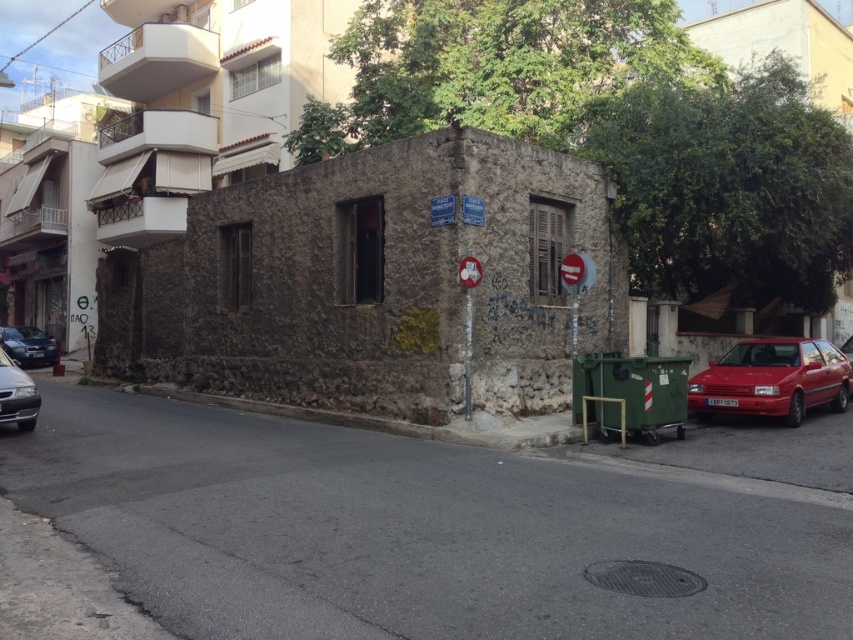
Question: Based on their relative distances, which object is nearer to the shiny black sedan at left?

Choices:
 (A) shiny red car at right
 (B) shiny silver sedan at lower left

Answer: (B)

Question: Among these objects, which one is farthest from the camera?

Choices:
 (A) shiny silver sedan at lower left
 (B) shiny black sedan at left
 (C) shiny red car at right

Answer: (B)

Question: Which point is closer to the camera?

Choices:
 (A) (30, 413)
 (B) (28, 332)

Answer: (A)

Question: Does shiny silver sedan at lower left appear over shiny black sedan at left?

Choices:
 (A) no
 (B) yes

Answer: (A)

Question: Is shiny silver sedan at lower left wider than shiny black sedan at left?

Choices:
 (A) no
 (B) yes

Answer: (A)

Question: Can you confirm if shiny silver sedan at lower left is positioned below shiny black sedan at left?

Choices:
 (A) no
 (B) yes

Answer: (B)